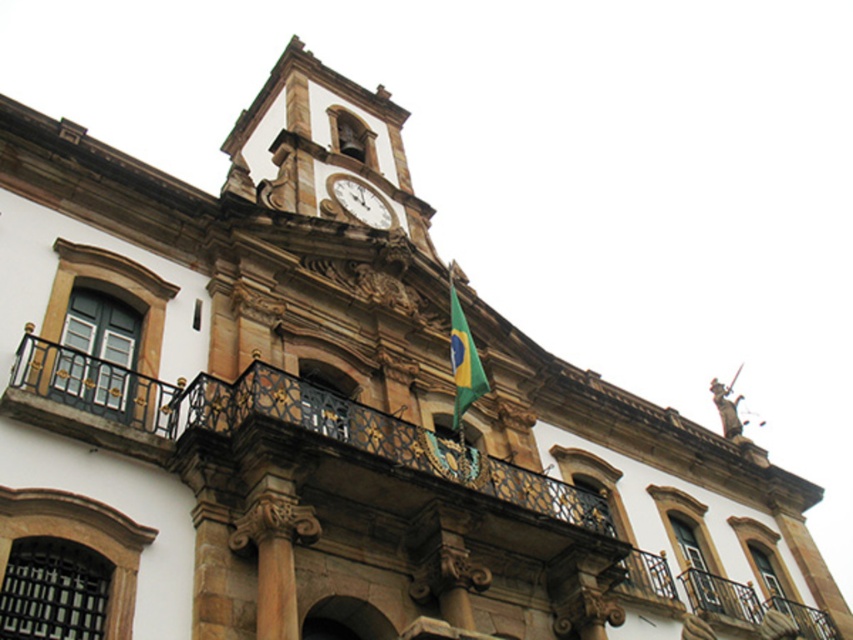
You are standing in front of the historic building and want to locate two specific points marked on the facade. The first point is at coordinates point(450, 314) and the second at point(375, 218). Which point is closer to you as you face the building?

Point(450, 314) is in front of point(375, 218), so it is closer to you as you face the building.

You are a photographer planning to take a picture of the historic building. You want to ensure both the green fabric flag at center and the white marble clock at upper center are clearly visible. Given their sizes, which object should you focus on to ensure both are in frame without needing to zoom in or out?

The green fabric flag at center is bigger than the white marble clock at upper center, so you should focus on the green fabric flag at center to ensure both are in frame without needing to adjust the zoom.

You are a drone operator tasked with capturing aerial footage of the historic building. Your drone must fly from the green fabric flag at center to the white marble clock at upper center. Given that the drone has a maximum flight range of 12 meters, will it be able to reach the clock from the flag?

The distance between the green fabric flag at center and the white marble clock at upper center is 13.37 meters. Since the drone has a maximum flight range of 12 meters, it will not be able to reach the clock from the flag.